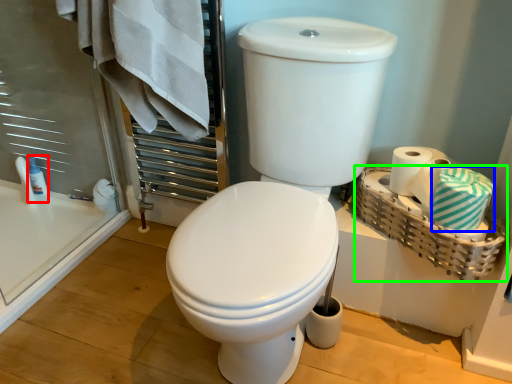
Question: Estimate the real-world distances between objects in this image. Which object is farther from toiletry (highlighted by a red box), bath towel (highlighted by a blue box) or basket (highlighted by a green box)?

Choices:
 (A) bath towel
 (B) basket

Answer: (A)